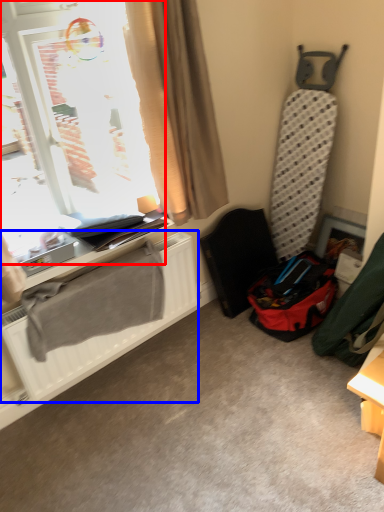
Question: Which object appears closest to the camera in this image, window (highlighted by a red box) or radiator (highlighted by a blue box)?

Choices:
 (A) window
 (B) radiator

Answer: (A)